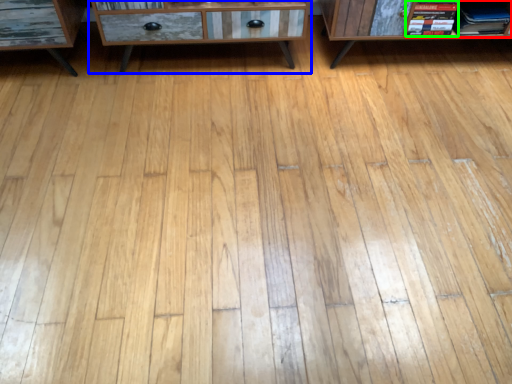
Question: Which object is positioned farthest from book (highlighted by a red box)? Select from chest of drawers (highlighted by a blue box) and book (highlighted by a green box).

Choices:
 (A) chest of drawers
 (B) book

Answer: (A)